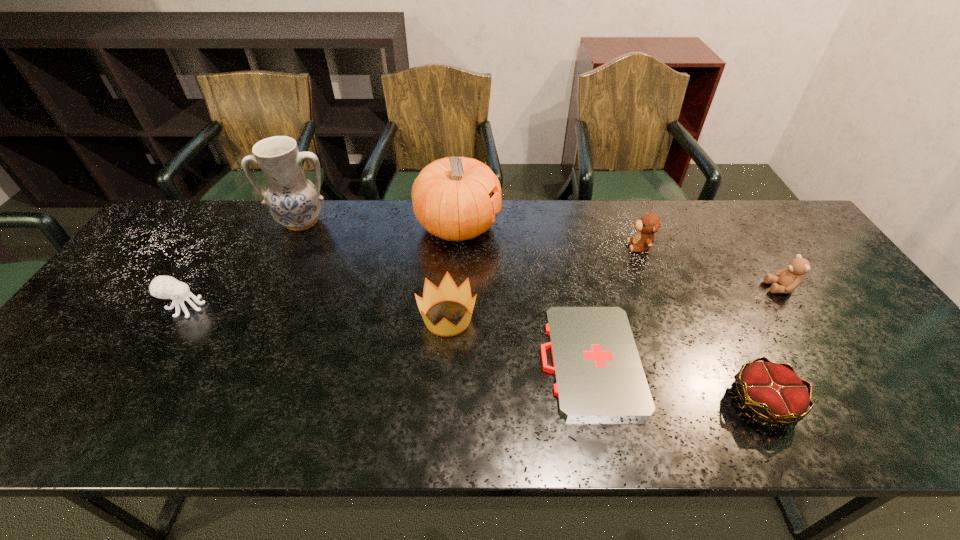
Find the location of `crown at the near edge`. crown at the near edge is located at coordinates (772, 391).

Find the location of a particular element. This screenshot has width=960, height=540. the first-aid kit located in the near edge section of the desktop is located at coordinates 598,373.

Where is `object situated at the right edge`? object situated at the right edge is located at coordinates (786, 280).

In the image, there is a desktop. At what (x,y) coordinates should I click in order to perform the action: click on free space at the far edge. Please return your answer as a coordinate pair (x, y). The image size is (960, 540). Looking at the image, I should click on (380, 211).

The height and width of the screenshot is (540, 960). In the image, there is a desktop. What are the coordinates of `vacant space at the near edge` in the screenshot? It's located at pyautogui.click(x=725, y=413).

At what (x,y) coordinates should I click in order to perform the action: click on vacant space at the left edge of the desktop. Please return your answer as a coordinate pair (x, y). Image resolution: width=960 pixels, height=540 pixels. Looking at the image, I should click on (121, 342).

You are a GUI agent. You are given a task and a screenshot of the screen. Output one action in this format:
    pyautogui.click(x=<x>, y=<y>)
    Task: Click on the blank space at the right edge
    The image size is (960, 540).
    Given the screenshot: What is the action you would take?
    pyautogui.click(x=892, y=360)

Find the location of `vacant space at the far right corner of the desktop`. vacant space at the far right corner of the desktop is located at coordinates (795, 223).

Locate an element on the screen. The height and width of the screenshot is (540, 960). empty location between the pottery and the right teddy bear is located at coordinates (541, 255).

I want to click on empty space between the farther teddy bear and the pumpkin, so click(549, 237).